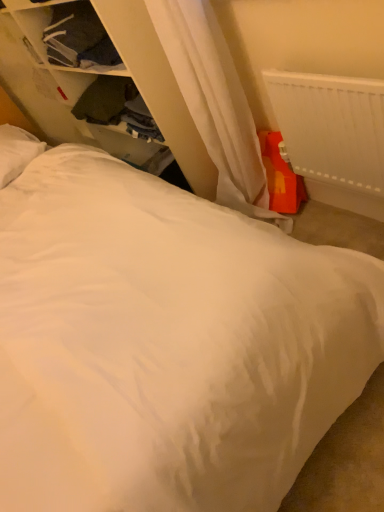
Question: Does white fabric dresser at upper left lie behind white plastic radiator at upper right?

Choices:
 (A) no
 (B) yes

Answer: (B)

Question: Can you confirm if white fabric dresser at upper left is smaller than white plastic radiator at upper right?

Choices:
 (A) no
 (B) yes

Answer: (A)

Question: Is white fabric dresser at upper left shorter than white plastic radiator at upper right?

Choices:
 (A) yes
 (B) no

Answer: (B)

Question: Does white fabric dresser at upper left appear on the right side of white plastic radiator at upper right?

Choices:
 (A) no
 (B) yes

Answer: (A)

Question: From the image's perspective, is white fabric dresser at upper left on white plastic radiator at upper right?

Choices:
 (A) yes
 (B) no

Answer: (A)

Question: Is white plastic radiator at upper right a part of white fabric dresser at upper left?

Choices:
 (A) no
 (B) yes

Answer: (A)

Question: Can you confirm if dark green fabric at upper left, positioned as the 2th clothing in top-to-bottom order, is taller than white plastic radiator at upper right?

Choices:
 (A) yes
 (B) no

Answer: (B)

Question: From a real-world perspective, is dark green fabric at upper left, the 1th clothing in the bottom-to-top sequence, located higher than white plastic radiator at upper right?

Choices:
 (A) no
 (B) yes

Answer: (B)

Question: Can you confirm if dark green fabric at upper left, the 1th clothing in the bottom-to-top sequence, is positioned to the left of white plastic radiator at upper right?

Choices:
 (A) no
 (B) yes

Answer: (B)

Question: Is dark green fabric at upper left, positioned as the 2th clothing in top-to-bottom order, completely or partially outside of white plastic radiator at upper right?

Choices:
 (A) yes
 (B) no

Answer: (A)

Question: From the image's perspective, is dark green fabric at upper left, positioned as the 2th clothing in top-to-bottom order, beneath white plastic radiator at upper right?

Choices:
 (A) no
 (B) yes

Answer: (A)

Question: Is dark green fabric at upper left, positioned as the 2th clothing in top-to-bottom order, facing away from white plastic radiator at upper right?

Choices:
 (A) no
 (B) yes

Answer: (A)

Question: From a real-world perspective, is white soft pillow at upper left below dark blue fabric at upper left, the 2th clothing positioned from the bottom?

Choices:
 (A) no
 (B) yes

Answer: (B)